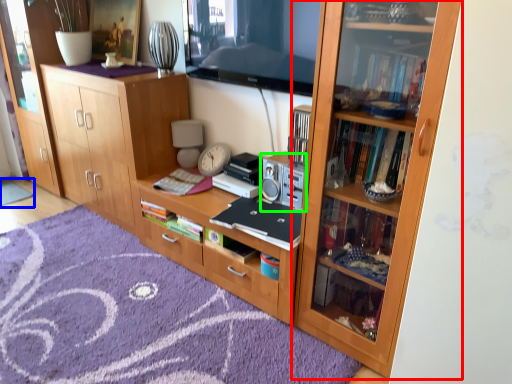
Question: Which object is the closest to the bookcase (highlighted by a red box)? Choose among these: doormat (highlighted by a blue box) or stereo (highlighted by a green box).

Choices:
 (A) doormat
 (B) stereo

Answer: (B)